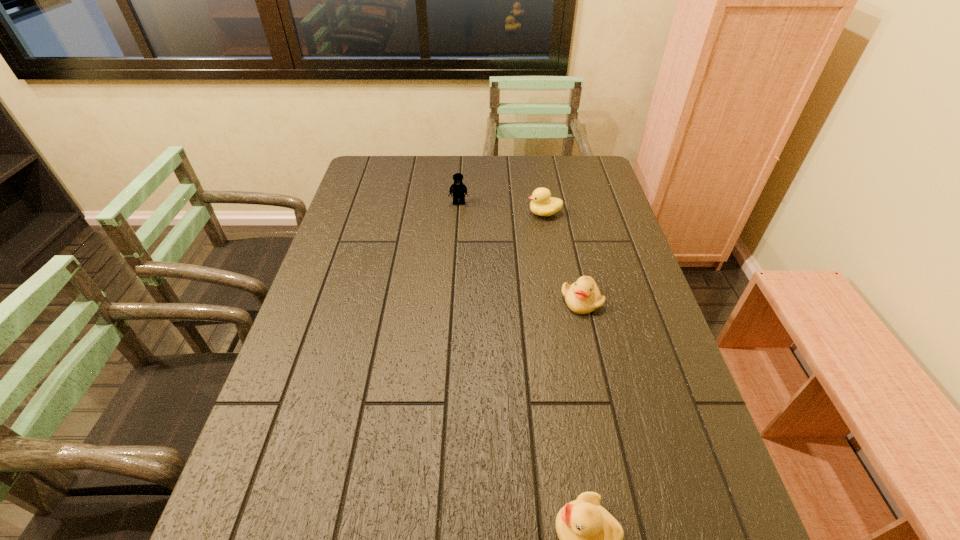
In the image, there is a desktop. Identify the location of blank space at the left edge. (333, 275).

I want to click on vacant space at the right edge of the desktop, so click(x=636, y=487).

I want to click on vacant space at the far left corner of the desktop, so click(393, 160).

At what (x,y) coordinates should I click in order to perform the action: click on vacant area at the far right corner. Please return your answer as a coordinate pair (x, y). Image resolution: width=960 pixels, height=540 pixels. Looking at the image, I should click on (x=571, y=169).

This screenshot has height=540, width=960. In order to click on unoccupied position between the farthest duckling and the second nearest duckling in this screenshot , I will do `click(563, 257)`.

The image size is (960, 540). In order to click on free point between the Lego and the farthest duckling in this screenshot , I will do `click(501, 208)`.

Where is `vacant space that's between the Lego and the farthest duckling`? vacant space that's between the Lego and the farthest duckling is located at coordinates (501, 208).

Identify the location of unoccupied area between the farthest duckling and the leftmost object. (501, 208).

Where is `vacant space in between the third farthest object and the Lego`? Image resolution: width=960 pixels, height=540 pixels. vacant space in between the third farthest object and the Lego is located at coordinates (520, 252).

You are a GUI agent. You are given a task and a screenshot of the screen. Output one action in this format:
    pyautogui.click(x=<x>, y=<y>)
    Task: Click on the empty space that is in between the second nearest object and the farthest duckling
    Image resolution: width=960 pixels, height=540 pixels.
    Given the screenshot: What is the action you would take?
    pyautogui.click(x=563, y=257)